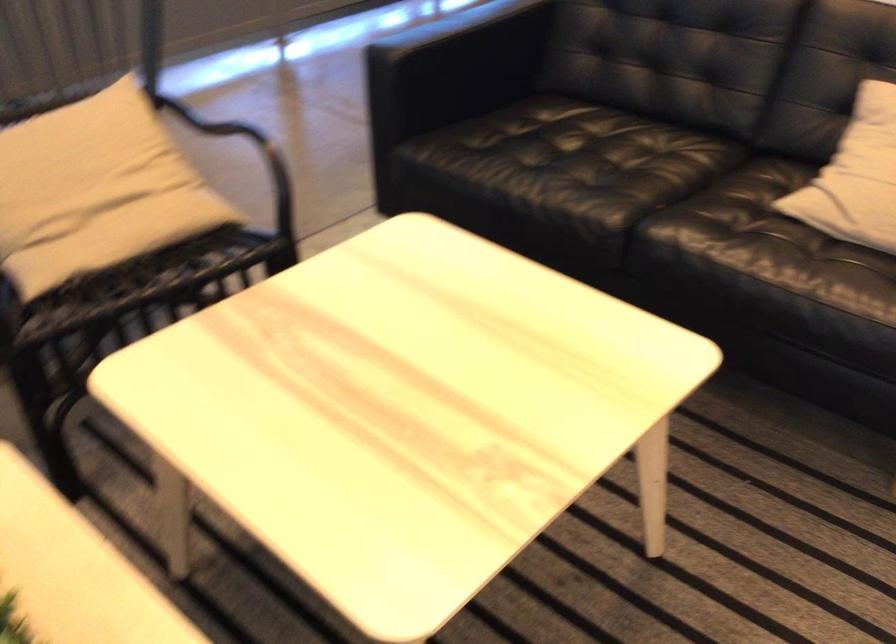
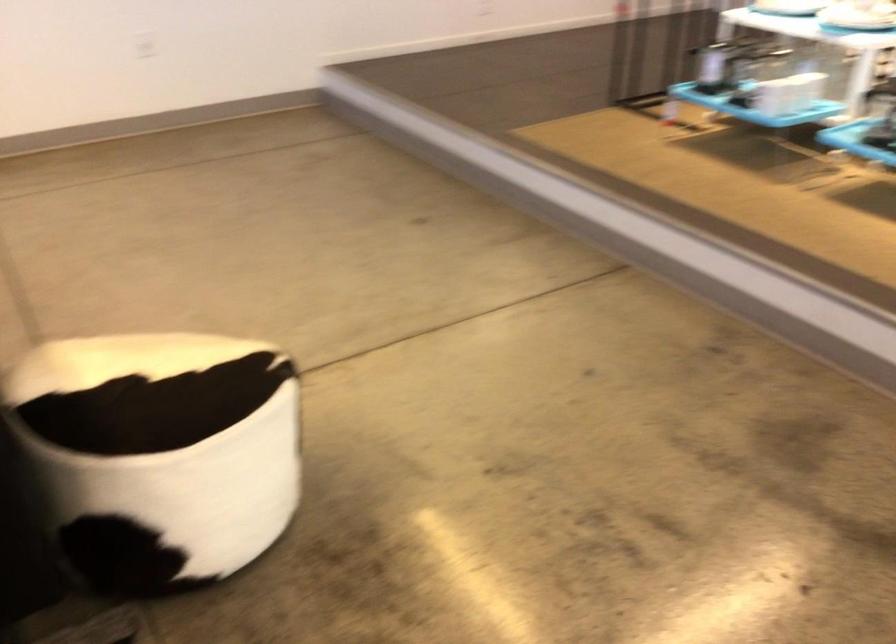
Question: The camera is either moving clockwise (left) or counter-clockwise (right) around the object. The first image is from the beginning of the video and the second image is from the end. Is the camera moving left or right when shooting the video?

Choices:
 (A) Left
 (B) Right

Answer: (A)